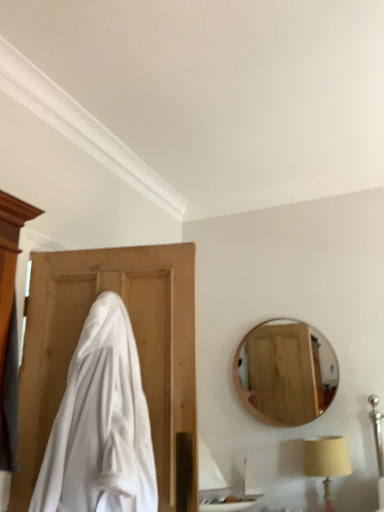
Question: Can we say beige fabric lampshade at lower right lies outside white cloth at left?

Choices:
 (A) no
 (B) yes

Answer: (B)

Question: Considering the relative sizes of beige fabric lampshade at lower right and white cloth at left in the image provided, is beige fabric lampshade at lower right smaller than white cloth at left?

Choices:
 (A) no
 (B) yes

Answer: (B)

Question: Is beige fabric lampshade at lower right positioned before white cloth at left?

Choices:
 (A) yes
 (B) no

Answer: (B)

Question: From the image's perspective, is beige fabric lampshade at lower right above white cloth at left?

Choices:
 (A) yes
 (B) no

Answer: (B)

Question: Is beige fabric lampshade at lower right aimed at white cloth at left?

Choices:
 (A) yes
 (B) no

Answer: (B)

Question: Considering the positions of white glossy sink at lower center and white cloth at left in the image, is white glossy sink at lower center taller or shorter than white cloth at left?

Choices:
 (A) short
 (B) tall

Answer: (A)

Question: From a real-world perspective, relative to white cloth at left, is white glossy sink at lower center vertically above or below?

Choices:
 (A) above
 (B) below

Answer: (B)

Question: Is white glossy sink at lower center inside the boundaries of white cloth at left, or outside?

Choices:
 (A) inside
 (B) outside

Answer: (B)

Question: From the image's perspective, relative to white cloth at left, is white glossy sink at lower center above or below?

Choices:
 (A) above
 (B) below

Answer: (B)

Question: From the image's perspective, relative to wooden mirror at upper right, is white cloth at left above or below?

Choices:
 (A) above
 (B) below

Answer: (A)

Question: In the image, is white cloth at left positioned in front of or behind wooden mirror at upper right?

Choices:
 (A) behind
 (B) front

Answer: (B)

Question: Considering the positions of point (127, 354) and point (241, 376), is point (127, 354) closer or farther from the camera than point (241, 376)?

Choices:
 (A) farther
 (B) closer

Answer: (B)

Question: Considering the positions of white cloth at left and wooden mirror at upper right in the image, is white cloth at left taller or shorter than wooden mirror at upper right?

Choices:
 (A) short
 (B) tall

Answer: (B)

Question: Considering the positions of beige fabric lampshade at lower right and wooden mirror at upper right in the image, is beige fabric lampshade at lower right wider or thinner than wooden mirror at upper right?

Choices:
 (A) thin
 (B) wide

Answer: (B)

Question: Considering the positions of beige fabric lampshade at lower right and wooden mirror at upper right in the image, is beige fabric lampshade at lower right taller or shorter than wooden mirror at upper right?

Choices:
 (A) short
 (B) tall

Answer: (A)